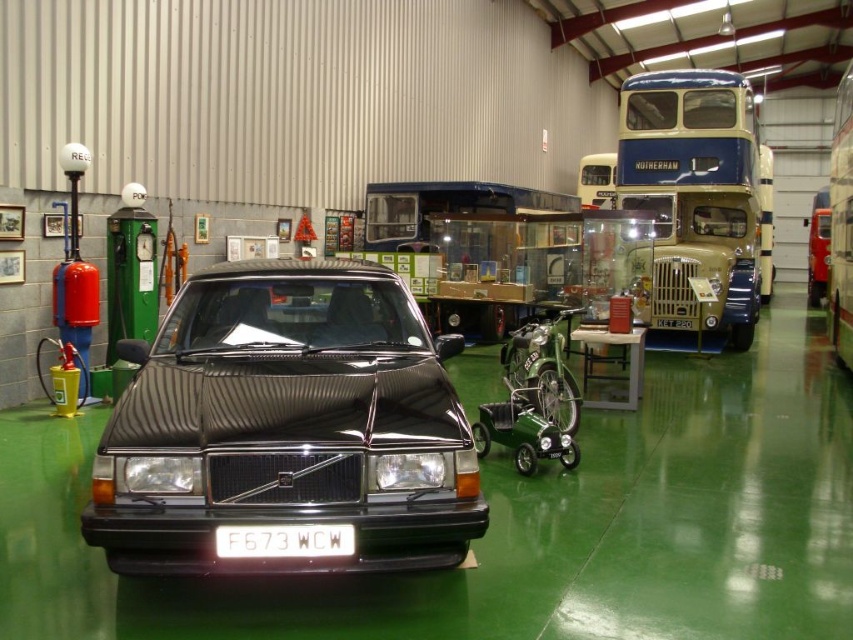
You are a photographer planning to take a photo of the shiny black car at center and the white plastic license plate at center. You want to ensure both are in focus. Since the car is much wider, will you need to adjust your camera settings to accommodate its size?

The shiny black car at center is wider than the white plastic license plate at center, so you should adjust your camera settings to focus on the larger object first to ensure both are in focus.

You are a photographer setting up a shot of the shiny black car at center and the white plastic license plate at center. You want to ensure both are in focus. Since the car is above the license plate, where should you position your camera relative to the car to capture both?

The shiny black car at center is located above the white plastic license plate at center. To capture both in focus, position the camera at the same level as the license plate, slightly below the car, ensuring both are within the depth of field.